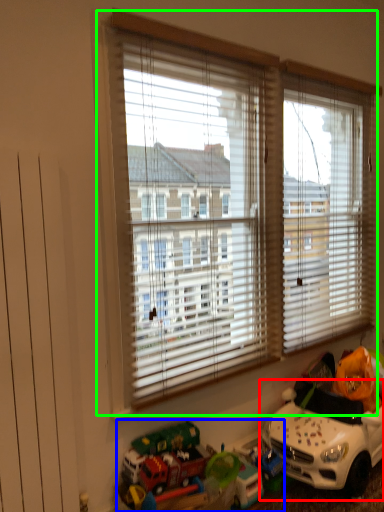
Question: Which object is positioned closest to toy (highlighted by a red box)? Select from toy (highlighted by a blue box) and window (highlighted by a green box).

Choices:
 (A) toy
 (B) window

Answer: (A)